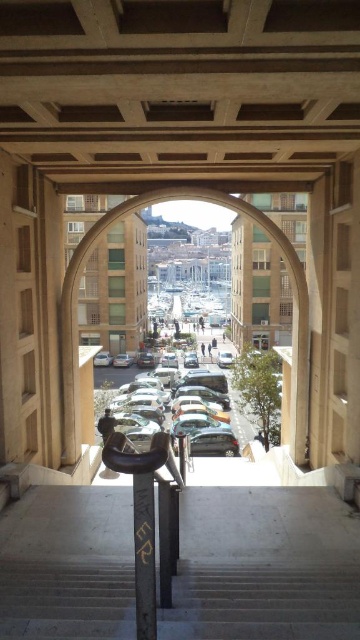
Between gray concrete stairs at center and shiny silver car at center, which one has more height?

shiny silver car at center

Who is more forward, (203, 592) or (115, 371)?

Point (203, 592) is more forward.

This screenshot has width=360, height=640. I want to click on gray concrete stairs at center, so click(263, 602).